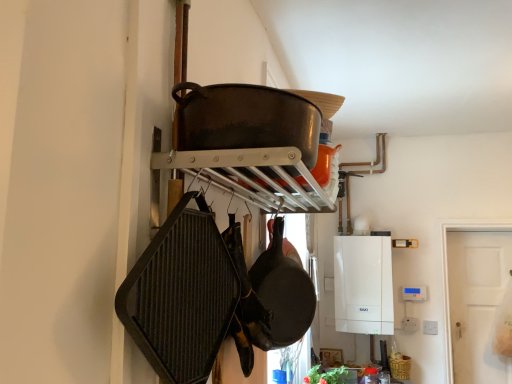
The width and height of the screenshot is (512, 384). What do you see at coordinates (181, 295) in the screenshot? I see `dark gray textured frying pan at left, placed as the first frying pan when sorted from left to right` at bounding box center [181, 295].

Where is `black matte frying pan at center, placed as the 2th frying pan when sorted from left to right`? The width and height of the screenshot is (512, 384). black matte frying pan at center, placed as the 2th frying pan when sorted from left to right is located at coordinates (283, 291).

Locate an element on the screen. This screenshot has height=384, width=512. white plastic boiler at center is located at coordinates (362, 285).

The image size is (512, 384). I want to click on dark gray textured frying pan at left, which is the first frying pan from front to back, so click(x=181, y=295).

Does point (192, 249) come farther from viewer compared to point (309, 319)?

No, (192, 249) is in front of (309, 319).

From a real-world perspective, is dark gray textured frying pan at left, which is the first frying pan from front to back, positioned under black matte frying pan at center, placed as the 1th frying pan when sorted from back to front, based on gravity?

Indeed, from a real-world perspective, dark gray textured frying pan at left, which is the first frying pan from front to back, is positioned beneath black matte frying pan at center, placed as the 1th frying pan when sorted from back to front.

Is dark gray textured frying pan at left, which is the first frying pan from front to back, taller than black matte frying pan at center, the second frying pan when ordered from front to back?

Incorrect, the height of dark gray textured frying pan at left, which is the first frying pan from front to back, is not larger of that of black matte frying pan at center, the second frying pan when ordered from front to back.

How many degrees apart are the facing directions of black matte frying pan at center, which is counted as the 1th frying pan, starting from the right, and white plastic boiler at center?

88.4 degrees.

Between black matte frying pan at center, placed as the 2th frying pan when sorted from left to right, and white plastic boiler at center, which one appears on the left side from the viewer's perspective?

black matte frying pan at center, placed as the 2th frying pan when sorted from left to right, is more to the left.

Considering the relative sizes of black matte frying pan at center, which is counted as the 1th frying pan, starting from the right, and white plastic boiler at center in the image provided, is black matte frying pan at center, which is counted as the 1th frying pan, starting from the right, shorter than white plastic boiler at center?

Yes.

From the image's perspective, which one is positioned lower, black matte frying pan at center, placed as the 2th frying pan when sorted from left to right, or dark gray textured frying pan at left, which ranks as the 2th frying pan in right-to-left order?

black matte frying pan at center, placed as the 2th frying pan when sorted from left to right, is shown below in the image.

From a real-world perspective, is black matte frying pan at center, which is counted as the 1th frying pan, starting from the right, physically above dark gray textured frying pan at left, which ranks as the 2th frying pan in right-to-left order?

Indeed, from a real-world perspective, black matte frying pan at center, which is counted as the 1th frying pan, starting from the right, stands above dark gray textured frying pan at left, which ranks as the 2th frying pan in right-to-left order.

Looking at this image, considering the relative positions of black matte frying pan at center, placed as the 2th frying pan when sorted from left to right, and dark gray textured frying pan at left, which is the 2th frying pan from back to front, in the image provided, is black matte frying pan at center, placed as the 2th frying pan when sorted from left to right, behind dark gray textured frying pan at left, which is the 2th frying pan from back to front,?

Yes, it is.

Consider the image. From the image's perspective, between dark brown cast iron wok at upper center and white plastic boiler at center, which one is located above?

dark brown cast iron wok at upper center, from the image's perspective.

Is the position of dark brown cast iron wok at upper center more distant than that of white plastic boiler at center?

No, the depth of dark brown cast iron wok at upper center is less than that of white plastic boiler at center.

Is dark brown cast iron wok at upper center not close to white plastic boiler at center?

dark brown cast iron wok at upper center is far away from white plastic boiler at center.

Which object is closer to the camera taking this photo, dark brown cast iron wok at upper center or dark gray textured frying pan at left, placed as the first frying pan when sorted from left to right?

Positioned in front is dark gray textured frying pan at left, placed as the first frying pan when sorted from left to right.

Considering the positions of objects dark brown cast iron wok at upper center and dark gray textured frying pan at left, which is the 2th frying pan from back to front, in the image provided, who is more to the right, dark brown cast iron wok at upper center or dark gray textured frying pan at left, which is the 2th frying pan from back to front,?

dark brown cast iron wok at upper center.

Is dark brown cast iron wok at upper center oriented away from dark gray textured frying pan at left, placed as the first frying pan when sorted from left to right?

No, dark brown cast iron wok at upper center is not facing the opposite direction of dark gray textured frying pan at left, placed as the first frying pan when sorted from left to right.

Locate an element on the screen. frying pan that is the 2nd one below the dark brown cast iron wok at upper center (from a real-world perspective) is located at coordinates (181, 295).

Considering the positions of point (347, 252) and point (312, 318), is point (347, 252) closer or farther from the camera than point (312, 318)?

Point (347, 252) appears to be farther away from the viewer than point (312, 318).

Is black matte frying pan at center, placed as the 1th frying pan when sorted from back to front, at the back of white plastic boiler at center?

No, black matte frying pan at center, placed as the 1th frying pan when sorted from back to front, is not at the back of white plastic boiler at center.

In terms of height, does white plastic boiler at center look taller or shorter compared to black matte frying pan at center, which is counted as the 1th frying pan, starting from the right?

Considering their sizes, white plastic boiler at center has more height than black matte frying pan at center, which is counted as the 1th frying pan, starting from the right.

Looking at this image, between white plastic boiler at center and black matte frying pan at center, placed as the 2th frying pan when sorted from left to right, which one has larger width?

With larger width is white plastic boiler at center.

Is point (348, 316) more distant than point (297, 115)?

Yes, it is.

Considering the sizes of objects white plastic boiler at center and dark brown cast iron wok at upper center in the image provided, who is thinner, white plastic boiler at center or dark brown cast iron wok at upper center?

dark brown cast iron wok at upper center.

Are white plastic boiler at center and dark brown cast iron wok at upper center located far from each other?

Yes.

Looking at this image, from a real-world perspective, is white plastic boiler at center under dark brown cast iron wok at upper center?

Yes, from a real-world perspective, white plastic boiler at center is below dark brown cast iron wok at upper center.

Find the location of a particular element. frying pan on the left of black matte frying pan at center, placed as the 1th frying pan when sorted from back to front is located at coordinates (181, 295).

Identify the location of the 1st frying pan in front of the white plastic boiler at center, starting your count from the anchor. The width and height of the screenshot is (512, 384). (283, 291).

When comparing their distances from white plastic boiler at center, does dark gray textured frying pan at left, which is the first frying pan from front to back, or dark brown cast iron wok at upper center seem further?

The object further to white plastic boiler at center is dark gray textured frying pan at left, which is the first frying pan from front to back.

Consider the image. Considering their positions, is dark gray textured frying pan at left, placed as the first frying pan when sorted from left to right, positioned further to white plastic boiler at center than black matte frying pan at center, the second frying pan when ordered from front to back?

dark gray textured frying pan at left, placed as the first frying pan when sorted from left to right, is positioned further to the anchor white plastic boiler at center.

Looking at the image, which one is located further to white plastic boiler at center, black matte frying pan at center, which is counted as the 1th frying pan, starting from the right, or dark brown cast iron wok at upper center?

Among the two, dark brown cast iron wok at upper center is located further to white plastic boiler at center.

Which object lies nearer to the anchor point white plastic boiler at center, black matte frying pan at center, placed as the 1th frying pan when sorted from back to front, or dark gray textured frying pan at left, which ranks as the 2th frying pan in right-to-left order?

black matte frying pan at center, placed as the 1th frying pan when sorted from back to front, is positioned closer to the anchor white plastic boiler at center.

Looking at the image, which one is located closer to dark gray textured frying pan at left, which ranks as the 2th frying pan in right-to-left order, white plastic boiler at center or dark brown cast iron wok at upper center?

The object closer to dark gray textured frying pan at left, which ranks as the 2th frying pan in right-to-left order, is dark brown cast iron wok at upper center.

Which object lies nearer to the anchor point white plastic boiler at center, dark brown cast iron wok at upper center or black matte frying pan at center, the second frying pan when ordered from front to back?

Based on the image, black matte frying pan at center, the second frying pan when ordered from front to back, appears to be nearer to white plastic boiler at center.

Based on their spatial positions, is dark gray textured frying pan at left, placed as the first frying pan when sorted from left to right, or white plastic boiler at center closer to black matte frying pan at center, the second frying pan when ordered from front to back?

dark gray textured frying pan at left, placed as the first frying pan when sorted from left to right, is closer to black matte frying pan at center, the second frying pan when ordered from front to back.

In the scene shown: Based on their spatial positions, is black matte frying pan at center, placed as the 2th frying pan when sorted from left to right, or white plastic boiler at center closer to dark gray textured frying pan at left, which is the 2th frying pan from back to front?

Among the two, black matte frying pan at center, placed as the 2th frying pan when sorted from left to right, is located nearer to dark gray textured frying pan at left, which is the 2th frying pan from back to front.

This screenshot has height=384, width=512. In order to click on frying pan between dark brown cast iron wok at upper center and white plastic boiler at center along the z-axis in this screenshot , I will do `click(283, 291)`.

This screenshot has width=512, height=384. Identify the location of frying pan between dark gray textured frying pan at left, which ranks as the 2th frying pan in right-to-left order, and white plastic boiler at center in the front-back direction. (283, 291).

Where is `wok between dark gray textured frying pan at left, which ranks as the 2th frying pan in right-to-left order, and black matte frying pan at center, which is counted as the 1th frying pan, starting from the right, from front to back`? Image resolution: width=512 pixels, height=384 pixels. wok between dark gray textured frying pan at left, which ranks as the 2th frying pan in right-to-left order, and black matte frying pan at center, which is counted as the 1th frying pan, starting from the right, from front to back is located at coordinates (246, 119).

Identify the location of wok between dark gray textured frying pan at left, which ranks as the 2th frying pan in right-to-left order, and white plastic boiler at center from front to back. Image resolution: width=512 pixels, height=384 pixels. (246, 119).